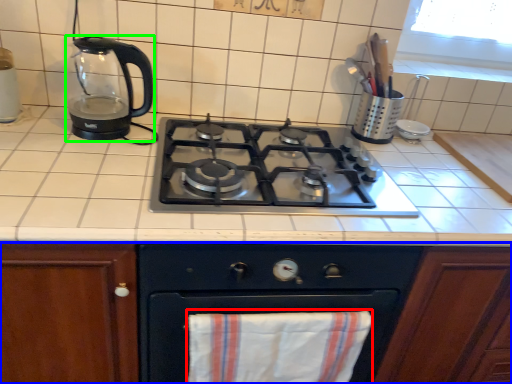
Question: Estimate the real-world distances between objects in this image. Which object is closer to beach towel (highlighted by a red box), cabinetry (highlighted by a blue box) or kitchen appliance (highlighted by a green box)?

Choices:
 (A) cabinetry
 (B) kitchen appliance

Answer: (A)